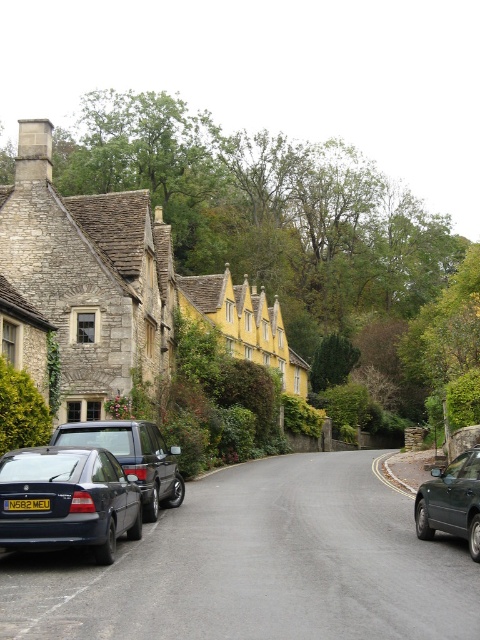
Does stone yellow houses at center have a larger size compared to matte black car at lower left?

Correct, stone yellow houses at center is larger in size than matte black car at lower left.

Between stone yellow houses at center and matte black car at lower left, which one is positioned lower?

matte black car at lower left is below.

Where is `stone yellow houses at center`? stone yellow houses at center is located at coordinates (119, 285).

Can you confirm if metallic dark green car at right is positioned below yellow matte license plate at center?

Actually, metallic dark green car at right is above yellow matte license plate at center.

Is point (452, 513) positioned in front of point (45, 504)?

No, (452, 513) is further to viewer.

Locate an element on the screen. This screenshot has width=480, height=640. metallic dark green car at right is located at coordinates (452, 500).

Who is shorter, matte black car at center or metallic dark green car at right?

Standing shorter between the two is metallic dark green car at right.

Which of these two, matte black car at center or metallic dark green car at right, stands taller?

matte black car at center

Locate an element on the screen. matte black car at center is located at coordinates (133, 458).

Find the location of a particular element. This screenshot has height=640, width=480. matte black car at center is located at coordinates (133, 458).